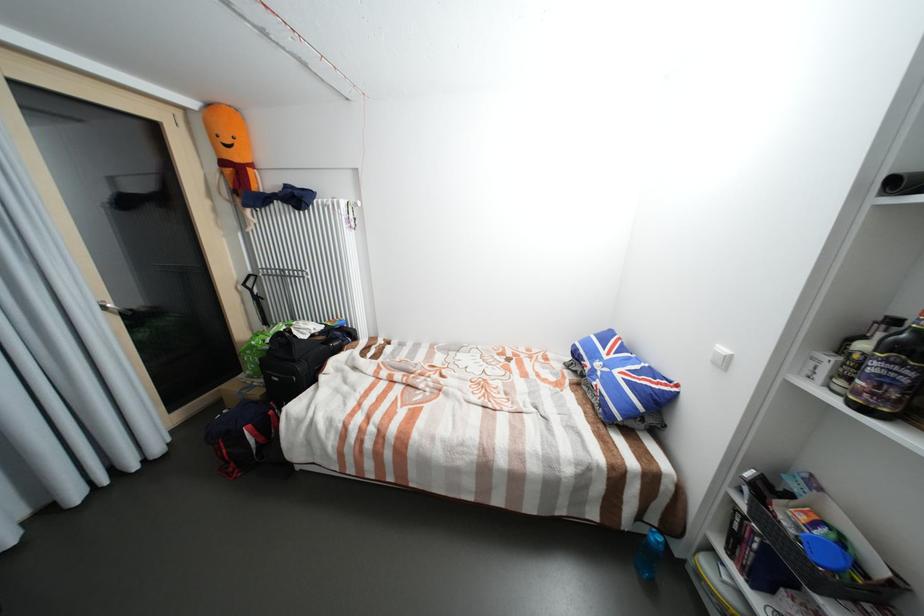
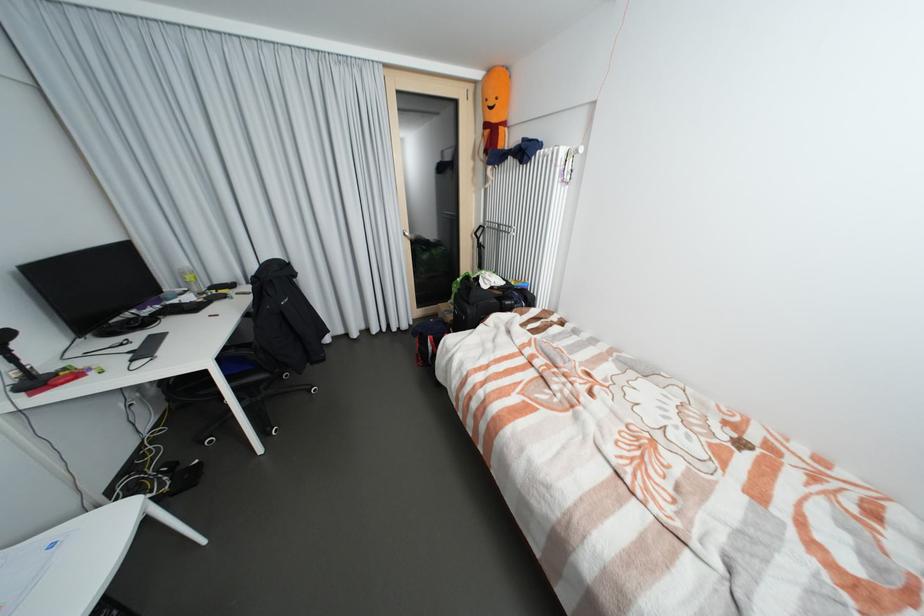
Locate, in the second image, the point that corresponds to (176,440) in the first image.

(418, 323)